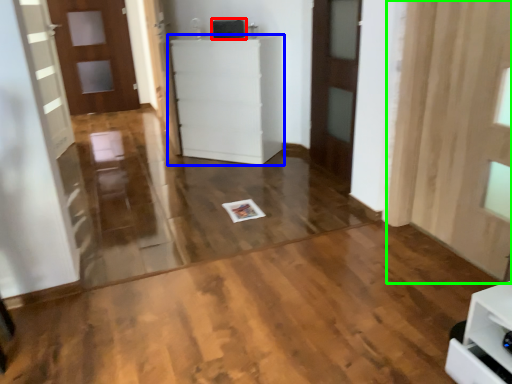
Question: Which object is positioned farthest from appliance (highlighted by a red box)? Select from furniture (highlighted by a blue box) and curtain (highlighted by a green box).

Choices:
 (A) furniture
 (B) curtain

Answer: (B)